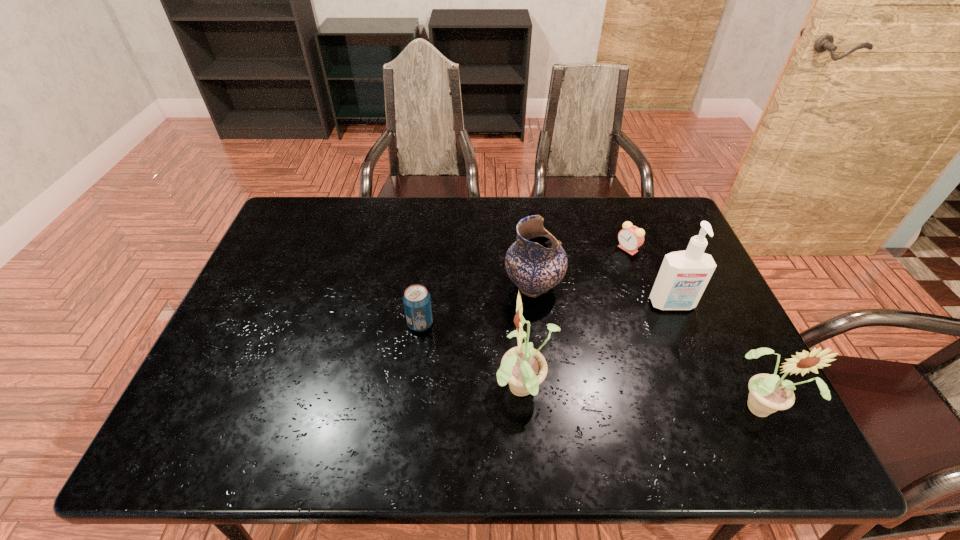
At what (x,y) coordinates should I click in order to perform the action: click on vacant space positioned on the front-facing side of the left sunflower. Please return your answer as a coordinate pair (x, y). Looking at the image, I should click on (412, 391).

The width and height of the screenshot is (960, 540). Identify the location of vacant area situated 0.180m on the face of the farthest object. (559, 249).

In order to click on vacant space located 0.340m on the face of the farthest object in this screenshot , I will do `click(508, 249)`.

In order to click on free space located 0.230m on the face of the farthest object in this screenshot , I will do `click(542, 249)`.

Where is `vacant space situated 0.170m on the back of the leftmost object`? Image resolution: width=960 pixels, height=540 pixels. vacant space situated 0.170m on the back of the leftmost object is located at coordinates (427, 270).

I want to click on free space located on the front of the pottery, so click(544, 383).

Find the location of a particular element. blank space located 0.140m on the front label of the cleansing agent is located at coordinates (694, 358).

Find the location of a particular element. The image size is (960, 540). sunflower located in the right edge section of the desktop is located at coordinates (768, 393).

Where is `cleansing agent that is positioned at the right edge`? This screenshot has width=960, height=540. cleansing agent that is positioned at the right edge is located at coordinates (683, 276).

This screenshot has width=960, height=540. I want to click on object situated at the near right corner, so click(x=768, y=393).